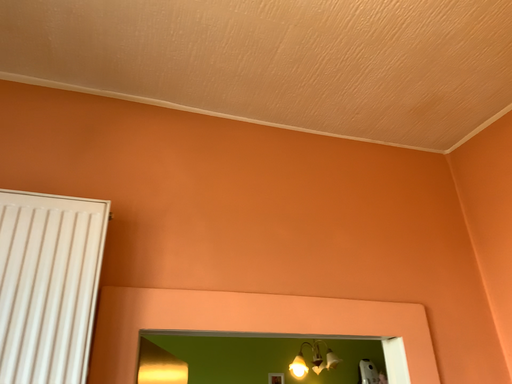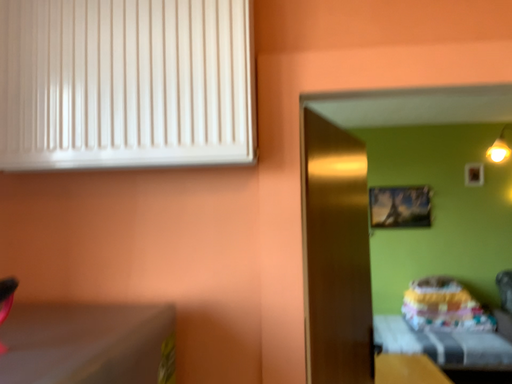
Question: Which way did the camera rotate in the video?

Choices:
 (A) rotated downward
 (B) rotated upward

Answer: (A)